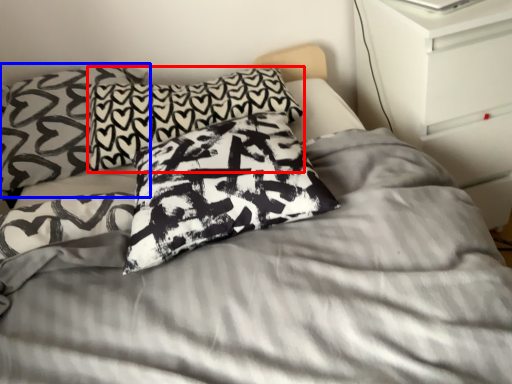
Question: Which of the following is the closest to the observer, pillow (highlighted by a red box) or pillow (highlighted by a blue box)?

Choices:
 (A) pillow
 (B) pillow

Answer: (B)